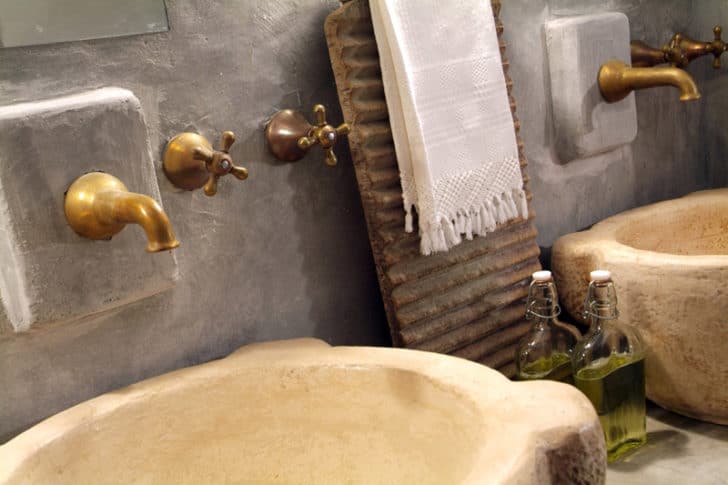
The image size is (728, 485). I want to click on tap, so click(x=667, y=82), click(x=127, y=205).